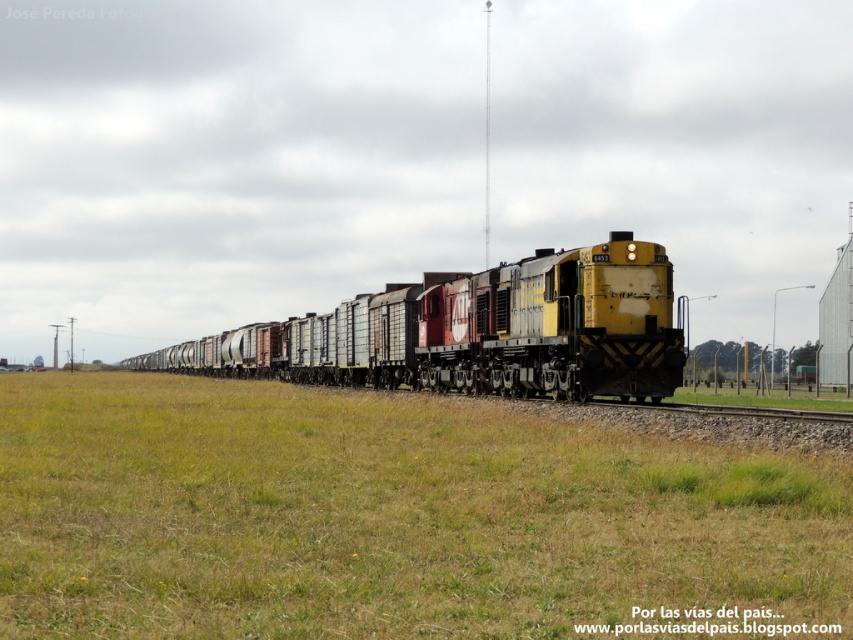
You are a bird flying over a rural area. You see a green grass at center and a yellow matte train at center. Which one is closer to you?

The green grass at center is closer to you because it is in front of the yellow matte train at center.

You are a passenger on a train and looking out the window. You see the green grass at center and the yellow matte train at center. Which one is closer to you?

The yellow matte train at center is closer to you because it is positioned above the green grass at center, which is underneath it.